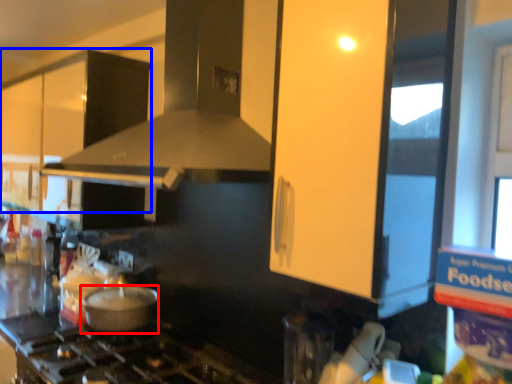
Question: Which object is closer to the camera taking this photo, kitchen appliance (highlighted by a red box) or cabinetry (highlighted by a blue box)?

Choices:
 (A) kitchen appliance
 (B) cabinetry

Answer: (A)